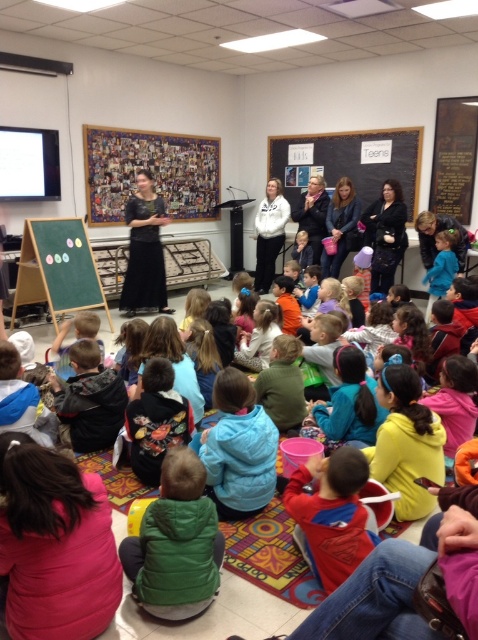
You are a teacher in the classroom and want to retrieve the red fleece jacket at lower center. Can you reach it without moving the blue fleece jacket at lower center?

The blue fleece jacket at lower center is positioned over the red fleece jacket at lower center, so you cannot reach the red fleece jacket at lower center without moving the blue fleece jacket at lower center.

You are a photographer setting up a camera to capture the entire scene of the classroom. The camera can only focus on objects wider than 1 meter. Given that the green fuzzy vest at lower center and the black chalkboard at upper center are in your frame, which object is wider and will ensure the camera focuses properly?

The black chalkboard at upper center is wider than the green fuzzy vest at lower center, so the camera will focus on it since it exceeds the 1 meter width requirement.